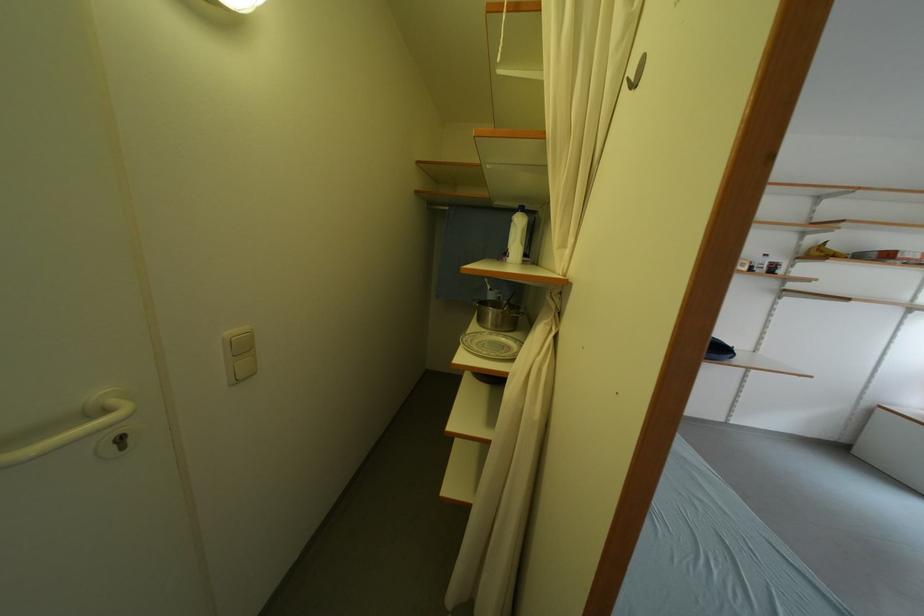
Which object does [517,236] point to?

It corresponds to the white plastic bottle in the image.